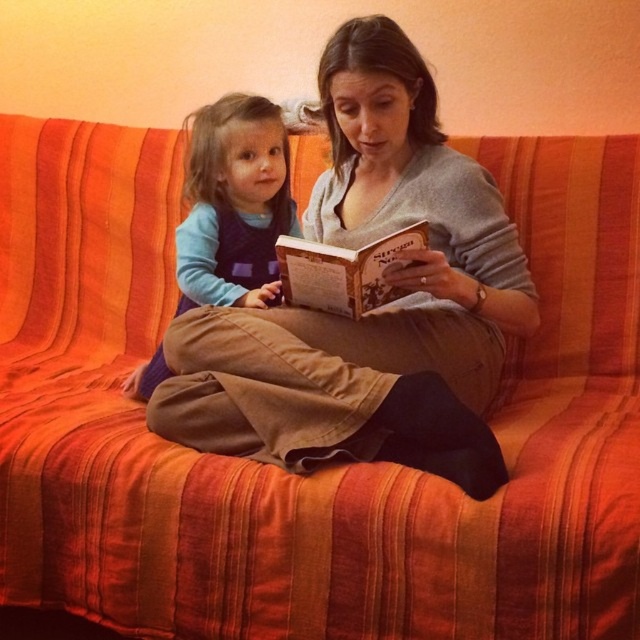
You are a photographer taking a picture of the scene. You need to ensure that both the matte gray sweater at center and the brown paper at center are clearly visible in the frame. Which object should you focus on to ensure the taller one is in focus?

The matte gray sweater at center is taller than the brown paper at center, so focusing on the matte gray sweater at center will ensure the taller object is in focus.

You are a photographer trying to capture a closeup of the brown paper at center in the image. However, the matte gray sweater at center is blocking your view. Can you move the sweater to get a clear shot?

The matte gray sweater at center is in front of the brown paper at center, so moving it would allow you to see the brown paper at center clearly.

You are organizing a clothing donation drive and need to determine which item takes up more space when folded. Based on the image, which of the two items, the matte gray sweater at center or the blue fleece top at upper left, has a greater width?

The matte gray sweater at center has a greater width than the blue fleece top at upper left according to the description.